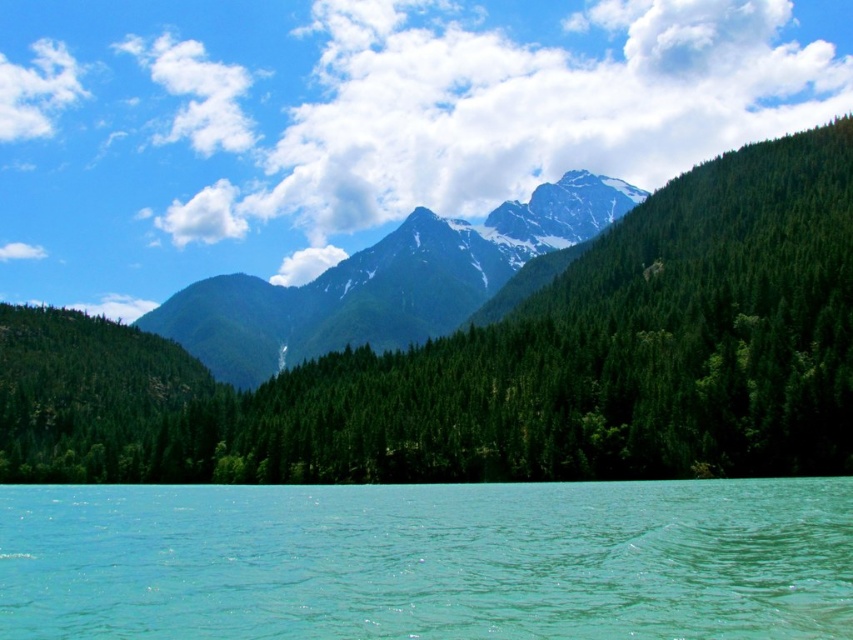
Question: Which point is closer to the camera?

Choices:
 (A) turquoise glassy water at lower center
 (B) green matte forest at center

Answer: (A)

Question: Does green matte forest at center have a greater width compared to turquoise glassy water at lower center?

Choices:
 (A) yes
 (B) no

Answer: (A)

Question: Is turquoise glassy water at lower center below snowy rocky mountain range at center?

Choices:
 (A) yes
 (B) no

Answer: (A)

Question: Which object is positioned closest to the snowy rocky mountain range at center?

Choices:
 (A) green matte forest at center
 (B) turquoise glassy water at lower center

Answer: (A)

Question: Is turquoise glassy water at lower center below snowy rocky mountain range at center?

Choices:
 (A) no
 (B) yes

Answer: (B)

Question: Which object is positioned closest to the green matte forest at center?

Choices:
 (A) turquoise glassy water at lower center
 (B) snowy rocky mountain range at center

Answer: (A)